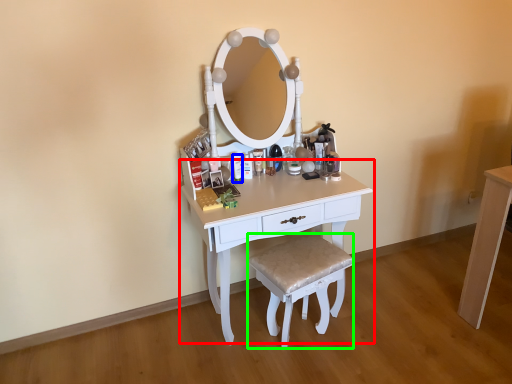
Question: Which object is the farthest from table (highlighted by a red box)? Choose among these: toiletry (highlighted by a blue box) or stool (highlighted by a green box).

Choices:
 (A) toiletry
 (B) stool

Answer: (A)